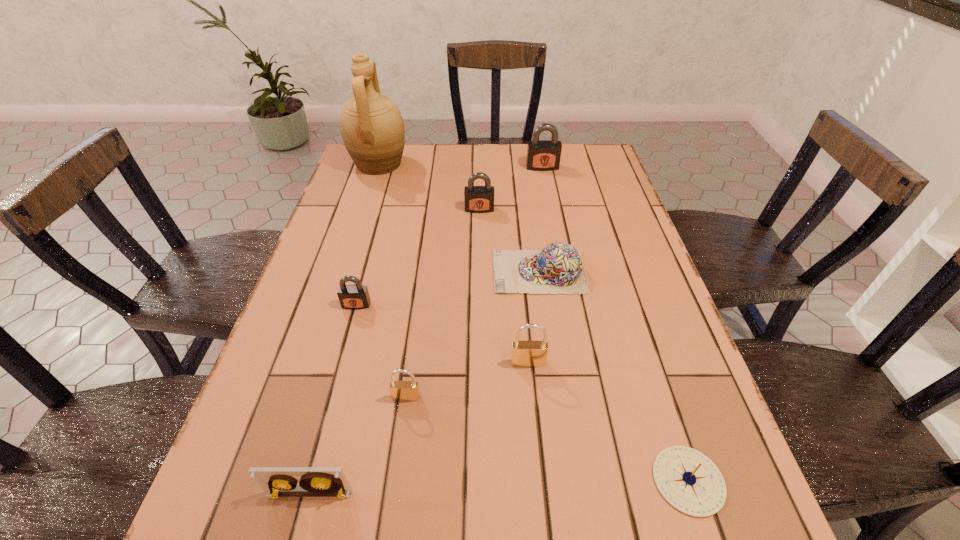
Find the location of a particular element. The image size is (960, 540). free space located on the front of the leftmost padlock near the keyhole is located at coordinates (318, 447).

The image size is (960, 540). Identify the location of free space located on the front-facing side of the second padlock from left to right. (401, 436).

Where is `vacant space located 0.090m on the front, side, and top of the second shortest object`? The image size is (960, 540). vacant space located 0.090m on the front, side, and top of the second shortest object is located at coordinates (457, 272).

Locate an element on the screen. The height and width of the screenshot is (540, 960). free spot located 0.250m on the front, side, and top of the second shortest object is located at coordinates (392, 272).

Locate an element on the screen. This screenshot has height=540, width=960. vacant space located on the front, side, and top of the second shortest object is located at coordinates (336, 272).

The width and height of the screenshot is (960, 540). Find the location of `free space located on the left of the shortest object`. free space located on the left of the shortest object is located at coordinates (557, 481).

Find the location of a particular element. This screenshot has height=540, width=960. pitcher that is at the far edge is located at coordinates (372, 128).

At what (x,y) coordinates should I click in order to perform the action: click on padlock that is at the far edge. Please return your answer as a coordinate pair (x, y). This screenshot has height=540, width=960. Looking at the image, I should click on (542, 155).

Find the location of a particular element. The image size is (960, 540). pitcher that is at the left edge is located at coordinates (372, 128).

Where is `padlock that is positioned at the left edge`? The height and width of the screenshot is (540, 960). padlock that is positioned at the left edge is located at coordinates (354, 297).